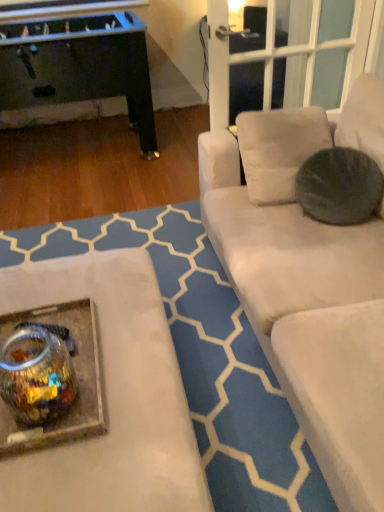
Image resolution: width=384 pixels, height=512 pixels. What are the coordinates of `dark gray fabric pillow at upper right` in the screenshot? It's located at (339, 186).

What do you see at coordinates (339, 186) in the screenshot? This screenshot has height=512, width=384. I see `dark gray fabric pillow at upper right` at bounding box center [339, 186].

In order to face dark gray fabric pillow at upper right, should I rotate leftwards or rightwards?

You should rotate right by 18.764 degrees.

The width and height of the screenshot is (384, 512). Find the location of `dark gray fabric pillow at upper right`. dark gray fabric pillow at upper right is located at coordinates (339, 186).